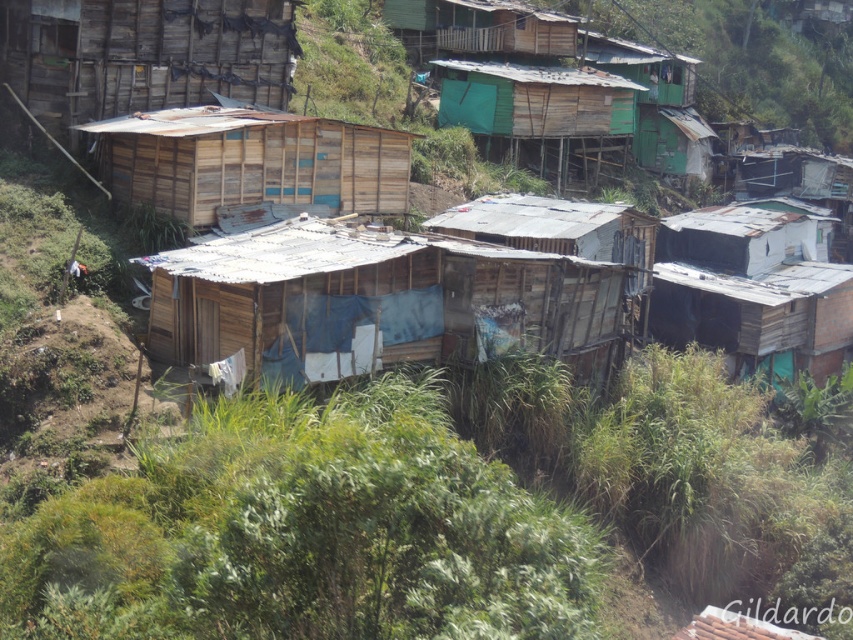
Question: Is wooden shack at upper left smaller than white corrugated metal hut at right?

Choices:
 (A) no
 (B) yes

Answer: (B)

Question: Is wooden shack at upper left to the left of white corrugated metal hut at right from the viewer's perspective?

Choices:
 (A) no
 (B) yes

Answer: (B)

Question: Does green grass at center appear on the left side of white corrugated metal hut at right?

Choices:
 (A) no
 (B) yes

Answer: (B)

Question: Among these points, which one is farthest from the camera?

Choices:
 (A) (799, 204)
 (B) (155, 93)
 (C) (209, 214)

Answer: (A)

Question: Which point appears farthest from the camera in this image?

Choices:
 (A) (740, 204)
 (B) (451, 317)
 (C) (473, 102)
 (D) (299, 125)

Answer: (A)

Question: Which point is farther to the camera?

Choices:
 (A) (675, 564)
 (B) (776, 218)
 (C) (498, 99)
 (D) (189, 326)

Answer: (B)